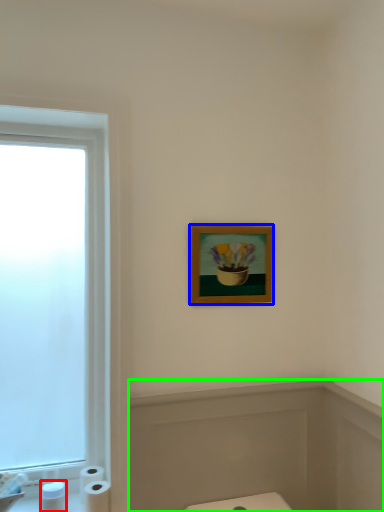
Question: Which is nearer to the toiletry (highlighted by a red box)? picture frame (highlighted by a blue box) or bath (highlighted by a green box).

Choices:
 (A) picture frame
 (B) bath

Answer: (B)